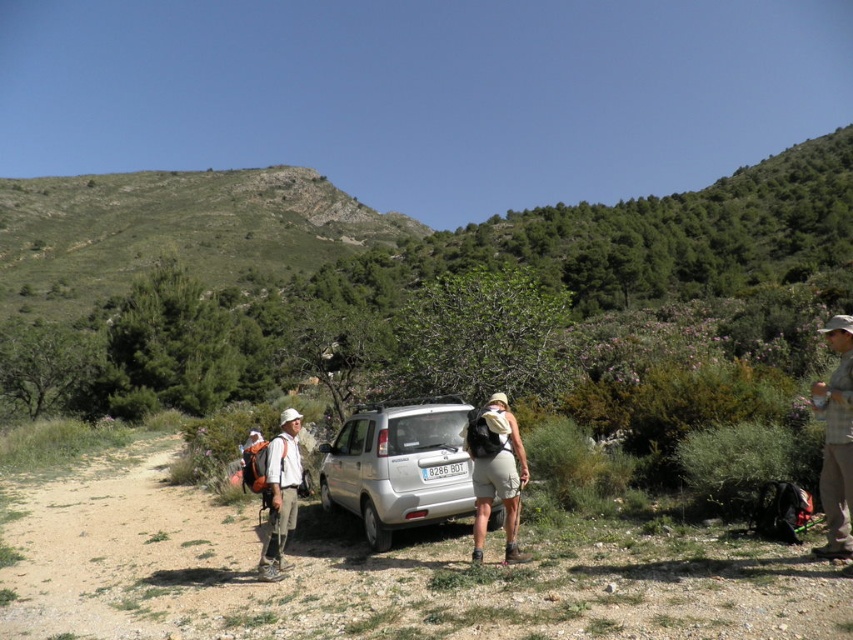
You are a hiker planning to walk along the gravel path at center. You have a pair of matte khaki shorts at center. Which one is longer in length?

The matte khaki shorts at center are longer than the gravel path at center according to the description.

You are a hiker who wants to take a photo of the silver metallic car at center and the matte khaki shorts at center from a position where both are visible in the frame. Given their height difference, which object would you need to adjust your camera angle to capture properly?

The silver metallic car at center is much taller than the matte khaki shorts at center, so you would need to lower your camera angle to include the entire car and raise it to capture the shorts at a better level. However, since the car is taller, adjusting the angle to see both might require a wide angle lens or moving to a higher vantage point.